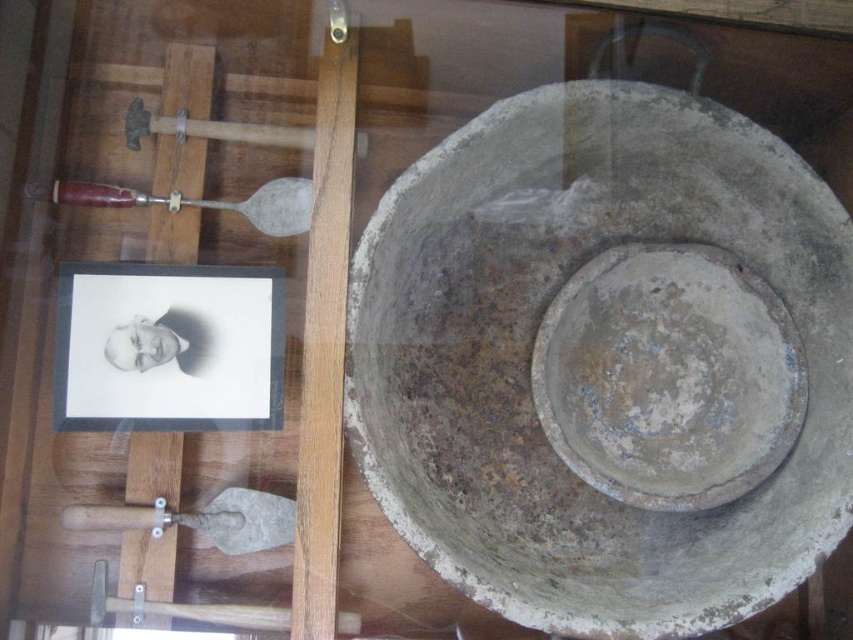
Question: Is wooden handle shovel at lower left thinner than wooden handle shovel at left?

Choices:
 (A) yes
 (B) no

Answer: (A)

Question: Is wooden handle shovel at lower left behind wooden handle shovel at left?

Choices:
 (A) no
 (B) yes

Answer: (A)

Question: Can you confirm if wooden handle shovel at lower left is wider than wooden handle shovel at left?

Choices:
 (A) no
 (B) yes

Answer: (A)